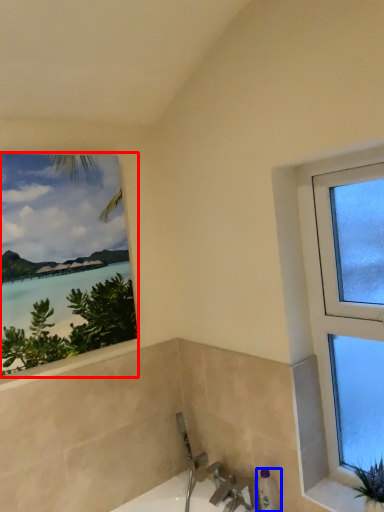
Question: Which object appears closest to the camera in this image, window (highlighted by a red box) or toiletry (highlighted by a blue box)?

Choices:
 (A) window
 (B) toiletry

Answer: (A)